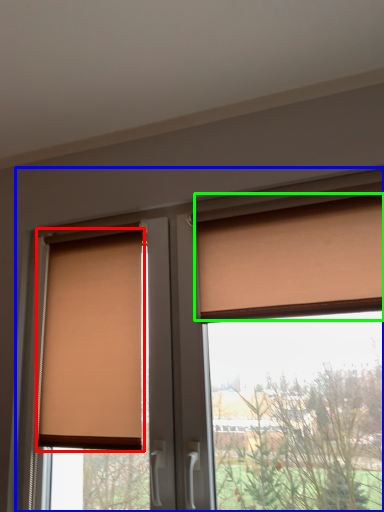
Question: Estimate the real-world distances between objects in this image. Which object is closer to window blind (highlighted by a red box), window (highlighted by a blue box) or curtain (highlighted by a green box)?

Choices:
 (A) window
 (B) curtain

Answer: (A)